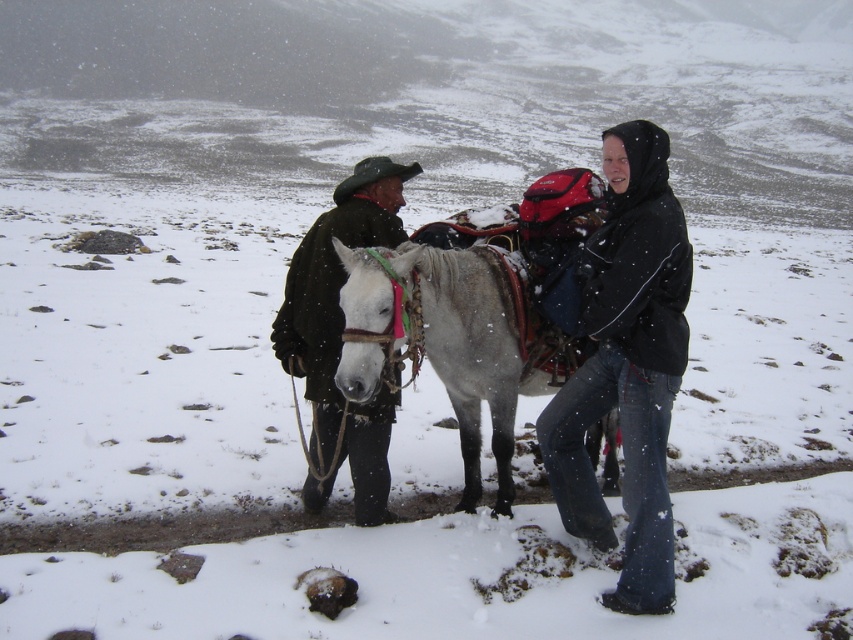
Describe the element at coordinates (624, 362) in the screenshot. I see `matte black jacket at center` at that location.

Between matte black jacket at center and dark brown leather jacket at center, which one is positioned higher?

dark brown leather jacket at center is higher up.

Where is `matte black jacket at center`? matte black jacket at center is located at coordinates (624, 362).

Does white leather mule at center appear under dark brown leather jacket at center?

Actually, white leather mule at center is above dark brown leather jacket at center.

Find the location of a particular element. The width and height of the screenshot is (853, 640). white leather mule at center is located at coordinates (471, 349).

Which is above, black matte jacket at center or white leather mule at center?

Positioned higher is black matte jacket at center.

Is point (567, 456) less distant than point (480, 349)?

Yes, it is.

Which is behind, point (619, 609) or point (453, 404)?

The point (453, 404) is behind.

Find the location of a particular element. black matte jacket at center is located at coordinates (627, 365).